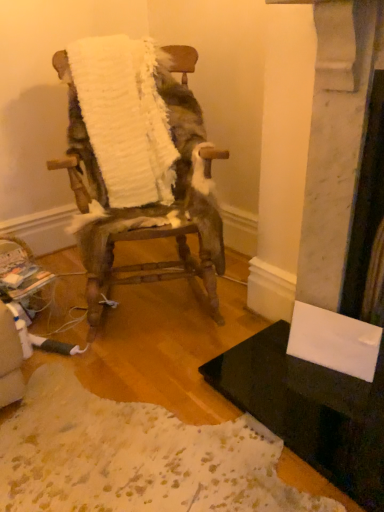
Question: Can you see white fluffy chair at center touching white fluffy blanket at center?

Choices:
 (A) no
 (B) yes

Answer: (A)

Question: Is white fluffy chair at center far from white fluffy blanket at center?

Choices:
 (A) yes
 (B) no

Answer: (B)

Question: Is the position of white fluffy chair at center less distant than that of white fluffy blanket at center?

Choices:
 (A) no
 (B) yes

Answer: (B)

Question: From a real-world perspective, is white fluffy chair at center located beneath white fluffy blanket at center?

Choices:
 (A) no
 (B) yes

Answer: (B)

Question: Does white fluffy chair at center turn towards white fluffy blanket at center?

Choices:
 (A) yes
 (B) no

Answer: (B)

Question: Can you confirm if white fluffy chair at center is positioned to the left of white fluffy blanket at center?

Choices:
 (A) no
 (B) yes

Answer: (A)

Question: From the image's perspective, is white fluffy blanket at center on top of white fluffy chair at center?

Choices:
 (A) yes
 (B) no

Answer: (A)

Question: Is white fluffy blanket at center oriented away from white fluffy chair at center?

Choices:
 (A) no
 (B) yes

Answer: (B)

Question: From a real-world perspective, does white fluffy blanket at center sit lower than white fluffy chair at center?

Choices:
 (A) no
 (B) yes

Answer: (A)

Question: Does white fluffy blanket at center lie behind white fluffy chair at center?

Choices:
 (A) no
 (B) yes

Answer: (B)

Question: Does white fluffy blanket at center touch white fluffy chair at center?

Choices:
 (A) yes
 (B) no

Answer: (B)

Question: Is white fluffy blanket at center smaller than white fluffy chair at center?

Choices:
 (A) yes
 (B) no

Answer: (A)

Question: Is black glossy table at lower right wider than white fluffy blanket at center?

Choices:
 (A) yes
 (B) no

Answer: (A)